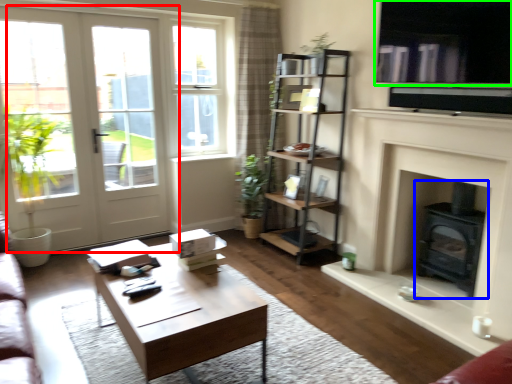
Question: Which object is the closest to the door (highlighted by a red box)? Choose among these: wood burning stove (highlighted by a blue box) or window screen (highlighted by a green box).

Choices:
 (A) wood burning stove
 (B) window screen

Answer: (B)